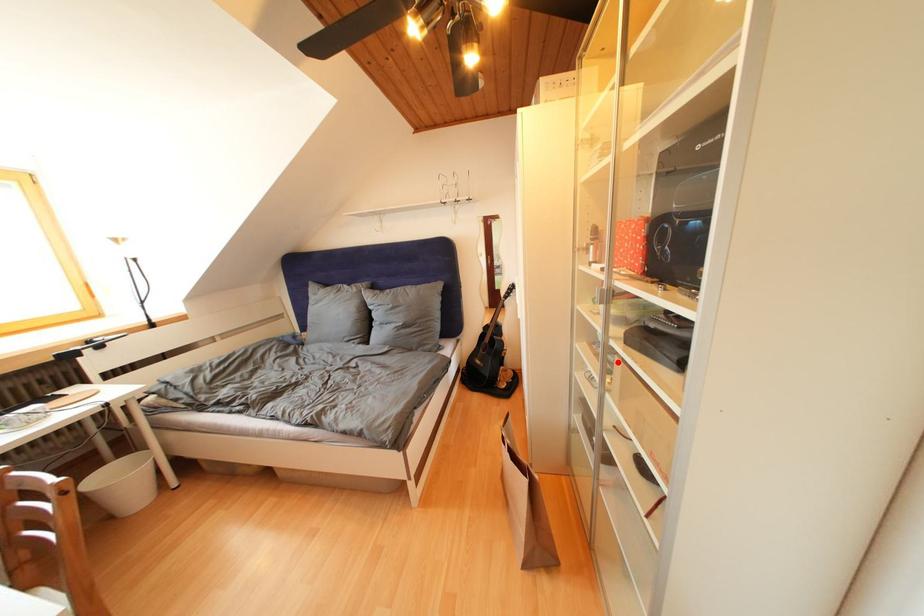
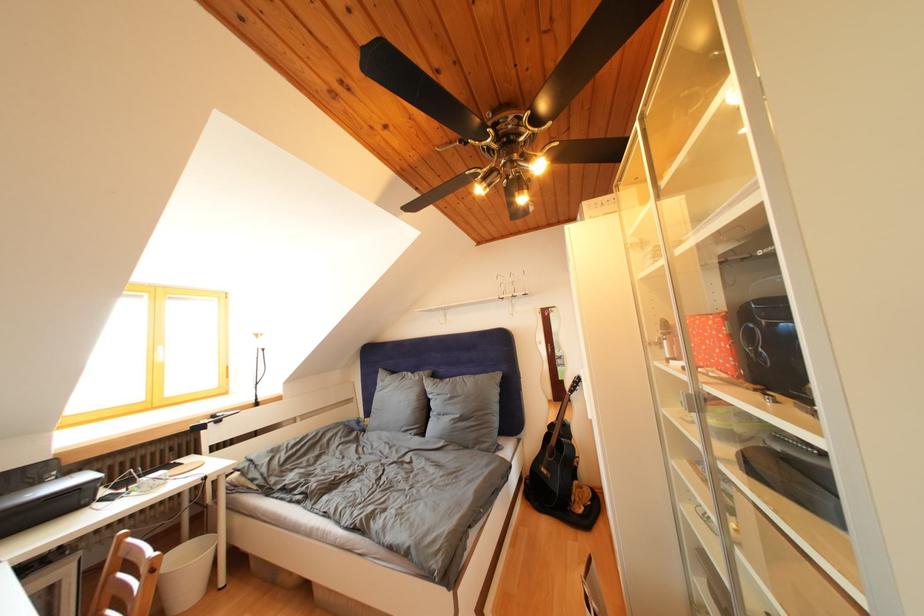
Find the pixel in the second image that matches the highlighted location in the first image.

(734, 492)